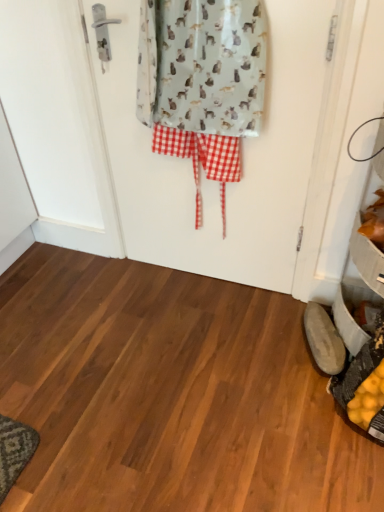
Where is `brown leather shoe at lower right`? The image size is (384, 512). brown leather shoe at lower right is located at coordinates (324, 340).

What do you see at coordinates (324, 340) in the screenshot? The height and width of the screenshot is (512, 384). I see `brown leather shoe at lower right` at bounding box center [324, 340].

This screenshot has height=512, width=384. What do you see at coordinates (202, 82) in the screenshot?
I see `light gray fabric with cat print at center` at bounding box center [202, 82].

What do you see at coordinates (374, 221) in the screenshot? I see `orange matte leaves at lower right` at bounding box center [374, 221].

Locate an element on the screen. The height and width of the screenshot is (512, 384). brown leather shoe at lower right is located at coordinates (324, 340).

Between point (191, 47) and point (330, 370), which one is positioned behind?

The point (330, 370) is farther from the camera.

Where is `laundry above the brown leather shoe at lower right (from the image's perspective)`? This screenshot has width=384, height=512. laundry above the brown leather shoe at lower right (from the image's perspective) is located at coordinates (202, 82).

In the scene shown: Would you say light gray fabric with cat print at center is inside or outside brown leather shoe at lower right?

light gray fabric with cat print at center lies outside brown leather shoe at lower right.

This screenshot has height=512, width=384. I want to click on food below the light gray fabric screen door at center (from the image's perspective), so click(374, 221).

From their relative heights in the image, would you say orange matte leaves at lower right is taller or shorter than light gray fabric screen door at center?

Clearly, orange matte leaves at lower right is shorter compared to light gray fabric screen door at center.

Is orange matte leaves at lower right looking in the opposite direction of light gray fabric screen door at center?

That's not correct — orange matte leaves at lower right is not looking away from light gray fabric screen door at center.

Is point (371, 234) in front of point (270, 206)?

Yes, point (371, 234) is closer to viewer.

Is brown leather shoe at lower right in front of or behind light gray fabric with cat print at center in the image?

brown leather shoe at lower right is positioned farther from the viewer than light gray fabric with cat print at center.

From the image's perspective, which is above, brown leather shoe at lower right or light gray fabric with cat print at center?

From the image's view, light gray fabric with cat print at center is above.

Considering the relative sizes of brown leather shoe at lower right and light gray fabric with cat print at center in the image provided, is brown leather shoe at lower right taller than light gray fabric with cat print at center?

No, brown leather shoe at lower right is not taller than light gray fabric with cat print at center.

From the picture: Would you say brown leather shoe at lower right contains light gray fabric with cat print at center?

That's incorrect, light gray fabric with cat print at center is not inside brown leather shoe at lower right.

Image resolution: width=384 pixels, height=512 pixels. Find the location of `food below the light gray fabric with cat print at center (from the image's perspective)`. food below the light gray fabric with cat print at center (from the image's perspective) is located at coordinates (374, 221).

Is light gray fabric with cat print at center shorter than orange matte leaves at lower right?

In fact, light gray fabric with cat print at center may be taller than orange matte leaves at lower right.

Is light gray fabric with cat print at center directly adjacent to orange matte leaves at lower right?

There is a gap between light gray fabric with cat print at center and orange matte leaves at lower right.

Is light gray fabric with cat print at center looking in the opposite direction of orange matte leaves at lower right?

No, orange matte leaves at lower right is not at the back of light gray fabric with cat print at center.

Is there a large distance between light gray fabric screen door at center and brown leather shoe at lower right?

No, light gray fabric screen door at center is not far from brown leather shoe at lower right.

From a real-world perspective, is light gray fabric screen door at center over brown leather shoe at lower right?

Yes, from a real-world perspective, light gray fabric screen door at center is over brown leather shoe at lower right

Who is bigger, light gray fabric screen door at center or brown leather shoe at lower right?

With larger size is light gray fabric screen door at center.

In the image, is light gray fabric screen door at center positioned in front of or behind brown leather shoe at lower right?

Visually, light gray fabric screen door at center is located in front of brown leather shoe at lower right.

From the image's perspective, is brown leather shoe at lower right above light gray fabric screen door at center?

No, from the image's perspective, brown leather shoe at lower right is not above light gray fabric screen door at center.

From their relative heights in the image, would you say brown leather shoe at lower right is taller or shorter than light gray fabric screen door at center?

In the image, brown leather shoe at lower right appears to be shorter than light gray fabric screen door at center.

In the scene shown: From a real-world perspective, is brown leather shoe at lower right on top of light gray fabric screen door at center?

Actually, brown leather shoe at lower right is physically below light gray fabric screen door at center in the real world.

Is brown leather shoe at lower right facing away from light gray fabric screen door at center?

brown leather shoe at lower right is not turned away from light gray fabric screen door at center.

From the picture: Looking at their sizes, would you say light gray fabric screen door at center is wider or thinner than orange matte leaves at lower right?

In the image, light gray fabric screen door at center appears to be more narrow than orange matte leaves at lower right.

Which object is closer to the camera taking this photo, light gray fabric screen door at center or orange matte leaves at lower right?

light gray fabric screen door at center is closer to the camera.

Considering the positions of objects light gray fabric screen door at center and orange matte leaves at lower right in the image provided, who is more to the right, light gray fabric screen door at center or orange matte leaves at lower right?

From the viewer's perspective, orange matte leaves at lower right appears more on the right side.

Is light gray fabric screen door at center located outside orange matte leaves at lower right?

Yes.

The width and height of the screenshot is (384, 512). What are the coordinates of `footwear behind the light gray fabric with cat print at center` in the screenshot? It's located at tap(324, 340).

Locate an element on the screen. food below the light gray fabric screen door at center (from a real-world perspective) is located at coordinates (374, 221).

Based on the photo, from the image, which object appears to be farther from brown leather shoe at lower right, light gray fabric with cat print at center or orange matte leaves at lower right?

The object further to brown leather shoe at lower right is light gray fabric with cat print at center.

Which object lies further to the anchor point light gray fabric screen door at center, brown leather shoe at lower right or light gray fabric with cat print at center?

brown leather shoe at lower right lies further to light gray fabric screen door at center than the other object.

Estimate the real-world distances between objects in this image. Which object is closer to brown leather shoe at lower right, light gray fabric screen door at center or light gray fabric with cat print at center?

light gray fabric screen door at center is closer to brown leather shoe at lower right.

Which object lies nearer to the anchor point orange matte leaves at lower right, light gray fabric screen door at center or brown leather shoe at lower right?

Based on the image, brown leather shoe at lower right appears to be nearer to orange matte leaves at lower right.

Based on their spatial positions, is light gray fabric screen door at center or brown leather shoe at lower right further from light gray fabric with cat print at center?

brown leather shoe at lower right lies further to light gray fabric with cat print at center than the other object.

Based on their spatial positions, is orange matte leaves at lower right or brown leather shoe at lower right further from light gray fabric with cat print at center?

brown leather shoe at lower right.

Looking at the image, which one is located closer to light gray fabric with cat print at center, orange matte leaves at lower right or light gray fabric screen door at center?

light gray fabric screen door at center is closer to light gray fabric with cat print at center.

Which object lies further to the anchor point orange matte leaves at lower right, brown leather shoe at lower right or light gray fabric screen door at center?

light gray fabric screen door at center lies further to orange matte leaves at lower right than the other object.

Locate an element on the screen. screen door located between light gray fabric with cat print at center and orange matte leaves at lower right in the left-right direction is located at coordinates (243, 159).

Where is `food that lies between light gray fabric with cat print at center and brown leather shoe at lower right from top to bottom`? food that lies between light gray fabric with cat print at center and brown leather shoe at lower right from top to bottom is located at coordinates (374, 221).

The image size is (384, 512). What are the coordinates of `food between light gray fabric screen door at center and brown leather shoe at lower right vertically` in the screenshot? It's located at (374, 221).

The width and height of the screenshot is (384, 512). Find the location of `screen door between light gray fabric with cat print at center and brown leather shoe at lower right in the up-down direction`. screen door between light gray fabric with cat print at center and brown leather shoe at lower right in the up-down direction is located at coordinates click(x=243, y=159).